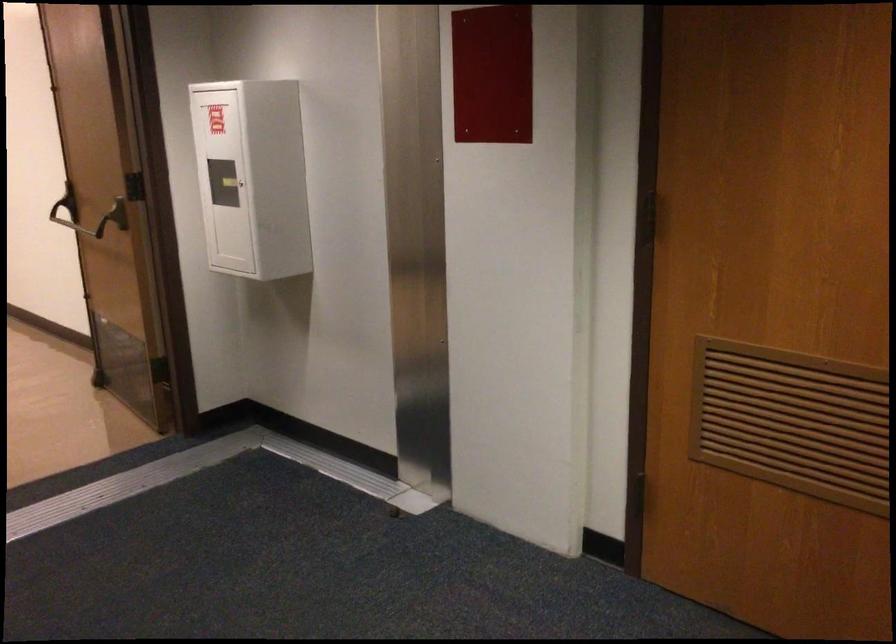
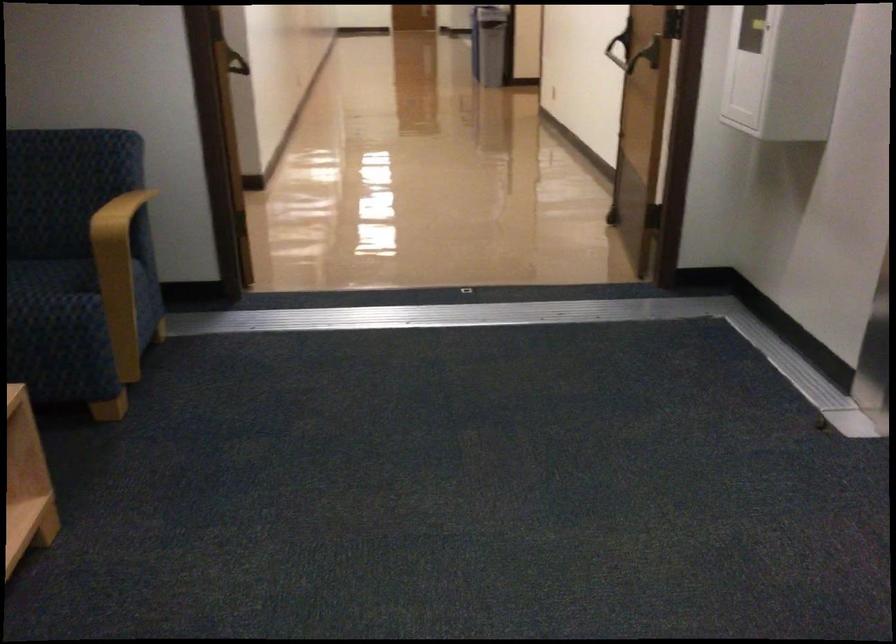
Question: The first image is from the beginning of the video and the second image is from the end. How did the camera likely rotate when shooting the video?

Choices:
 (A) Left
 (B) Right
 (C) Up
 (D) Down

Answer: (A)